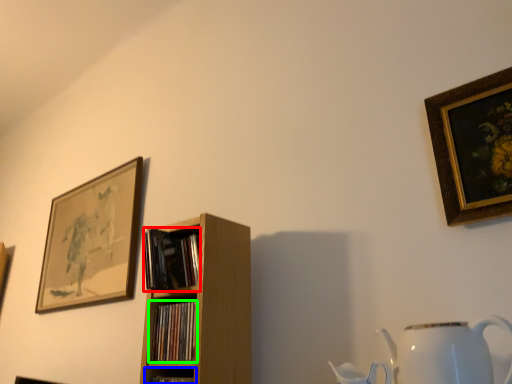
Question: Which object is the farthest from book (highlighted by a red box)? Choose among these: shelf (highlighted by a blue box) or book (highlighted by a green box).

Choices:
 (A) shelf
 (B) book

Answer: (A)